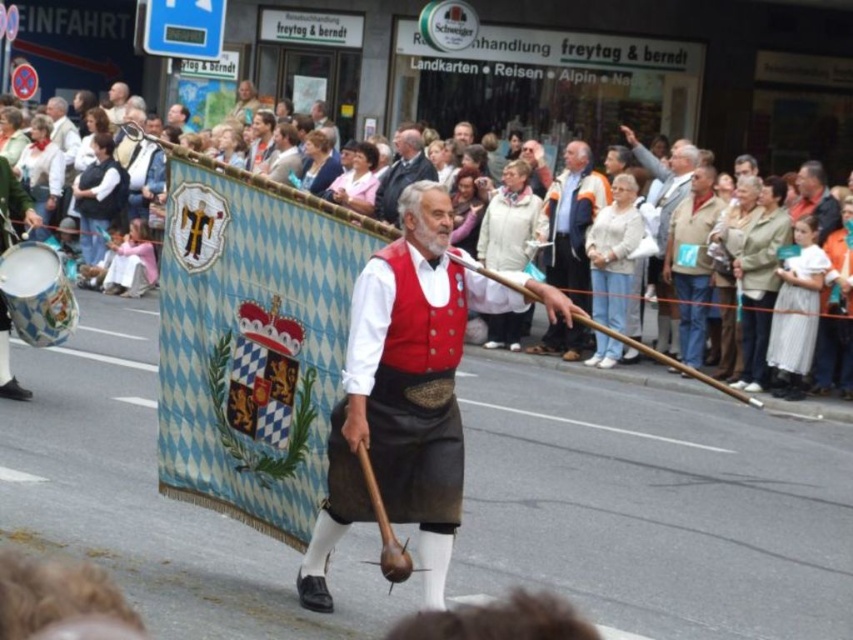
Question: Is red jacket at center closer to camera compared to red velvet vest at center?

Choices:
 (A) yes
 (B) no

Answer: (A)

Question: Which of the following is the closest to the observer?

Choices:
 (A) (86, 118)
 (B) (450, 460)
 (C) (401, 157)
 (D) (573, 324)

Answer: (B)

Question: Can you confirm if light beige fabric crowd at upper center is smaller than red jacket at center?

Choices:
 (A) yes
 (B) no

Answer: (B)

Question: Can you confirm if red jacket at center is positioned below red velvet vest at center?

Choices:
 (A) no
 (B) yes

Answer: (B)

Question: Which point appears closest to the camera in this image?

Choices:
 (A) (410, 141)
 (B) (363, 353)

Answer: (B)

Question: Which is farther from the light beige fabric crowd at upper center?

Choices:
 (A) matte red vest at center
 (B) red velvet vest at center
 (C) red jacket at center

Answer: (A)